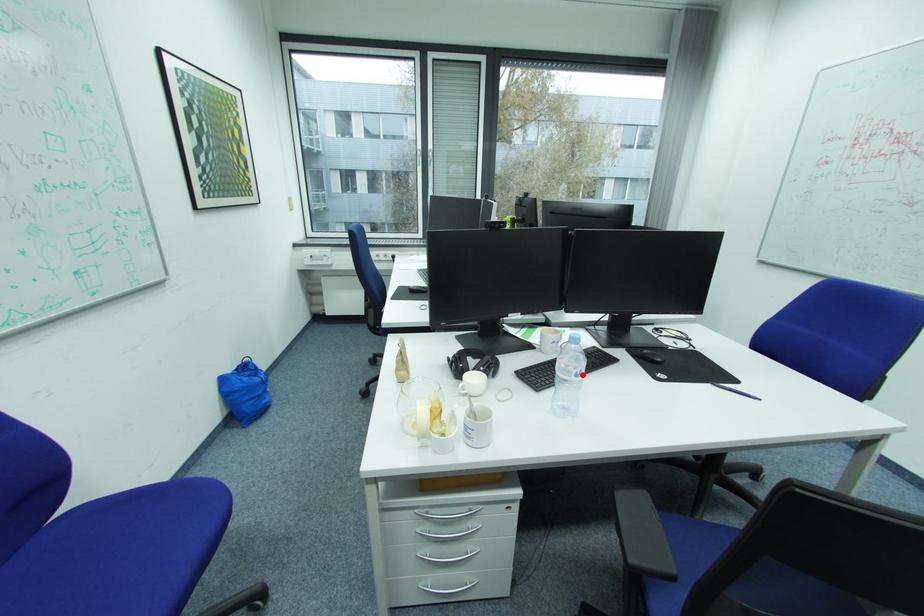
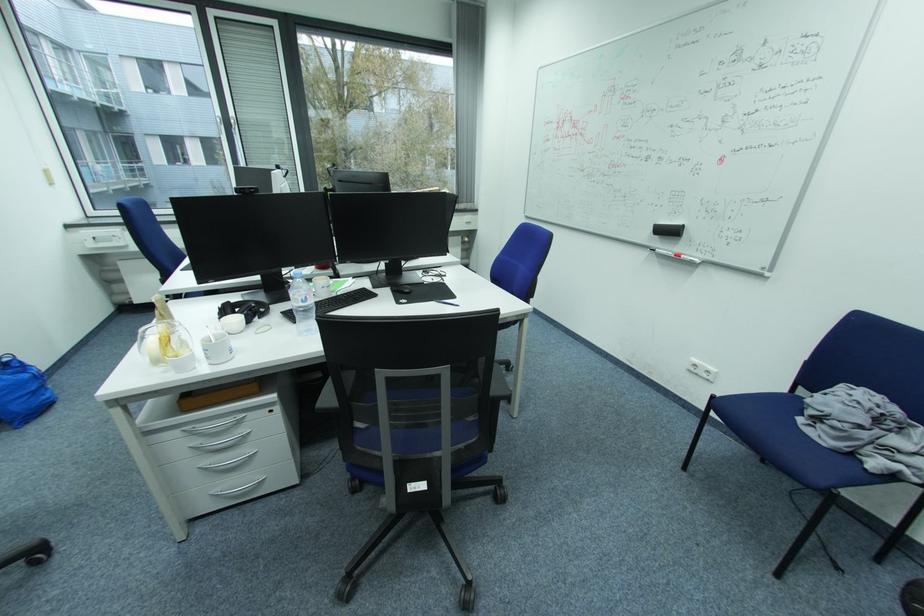
Locate, in the second image, the point that corresponds to the highlighted location in the first image.

(310, 301)